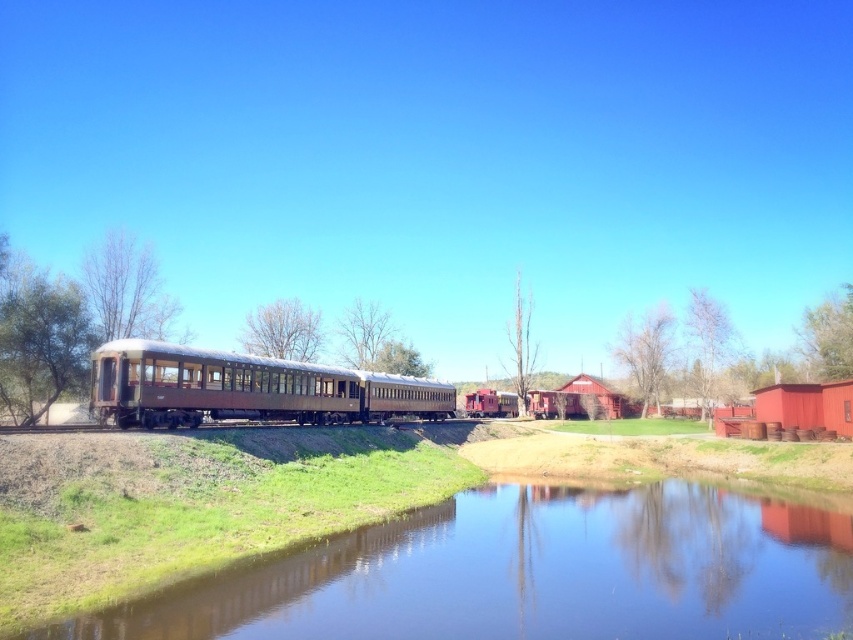
Is clear water at center wider than rusty metal train car at center?

Correct, the width of clear water at center exceeds that of rusty metal train car at center.

Does clear water at center come behind rusty metal train car at center?

No.

Which is behind, point (535, 536) or point (193, 412)?

The point (193, 412) is more distant.

Find the location of a particular element. The width and height of the screenshot is (853, 640). clear water at center is located at coordinates (527, 573).